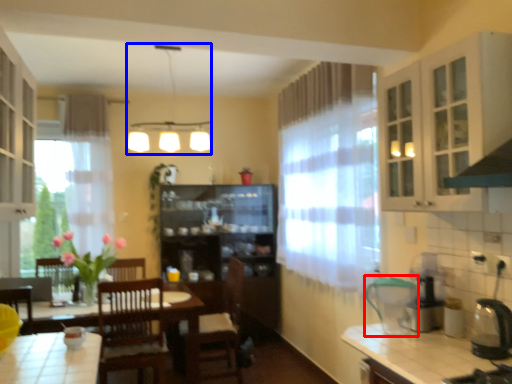
Question: Which of the following is the farthest to the observer, appliance (highlighted by a red box) or light fixture (highlighted by a blue box)?

Choices:
 (A) appliance
 (B) light fixture

Answer: (B)